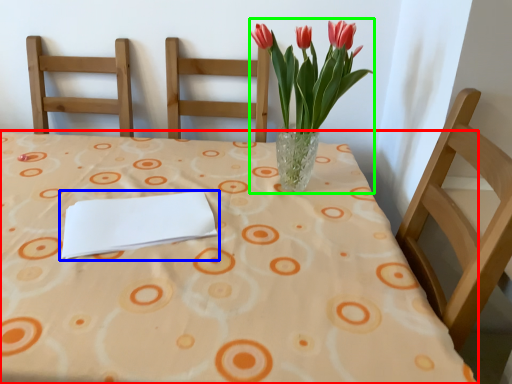
Question: Based on their relative distances, which object is farther from table (highlighted by a red box)? Choose from journal (highlighted by a blue box) and floral arrangement (highlighted by a green box).

Choices:
 (A) journal
 (B) floral arrangement

Answer: (B)